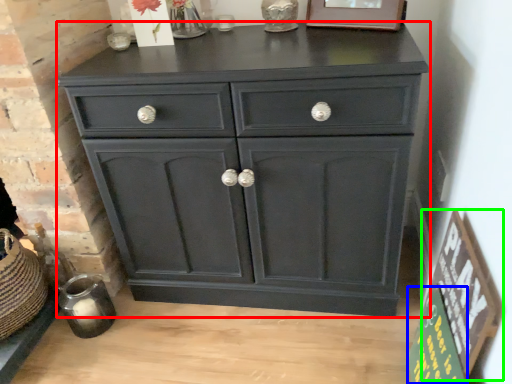
Question: Considering the real-world distances, which object is farthest from chest of drawers (highlighted by a red box)? bulletin board (highlighted by a blue box) or bulletin board (highlighted by a green box)?

Choices:
 (A) bulletin board
 (B) bulletin board

Answer: (A)